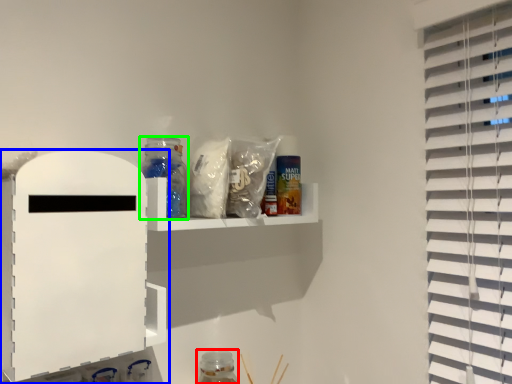
Question: Which is farther away from bottle (highlighted by a red box)? shelf (highlighted by a blue box) or bottle (highlighted by a green box)?

Choices:
 (A) shelf
 (B) bottle

Answer: (A)